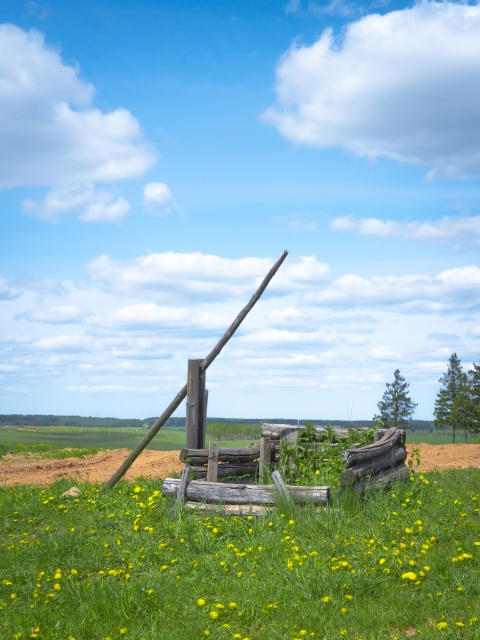
Question: Which point is closer to the camera?

Choices:
 (A) (141, 440)
 (B) (226, 531)

Answer: (B)

Question: Which point is closer to the camera taking this photo?

Choices:
 (A) (240, 483)
 (B) (167, 408)

Answer: (A)

Question: Does yellow grass at center appear under rustic wooden pole at center?

Choices:
 (A) no
 (B) yes

Answer: (B)

Question: Does weathered wood fence at center have a larger size compared to rustic wooden pole at center?

Choices:
 (A) no
 (B) yes

Answer: (B)

Question: Can you confirm if yellow grass at center is positioned to the left of rustic wooden pole at center?

Choices:
 (A) no
 (B) yes

Answer: (A)

Question: Which object appears closest to the camera in this image?

Choices:
 (A) rustic wooden pole at center
 (B) weathered wood fence at center
 (C) yellow grass at center

Answer: (C)